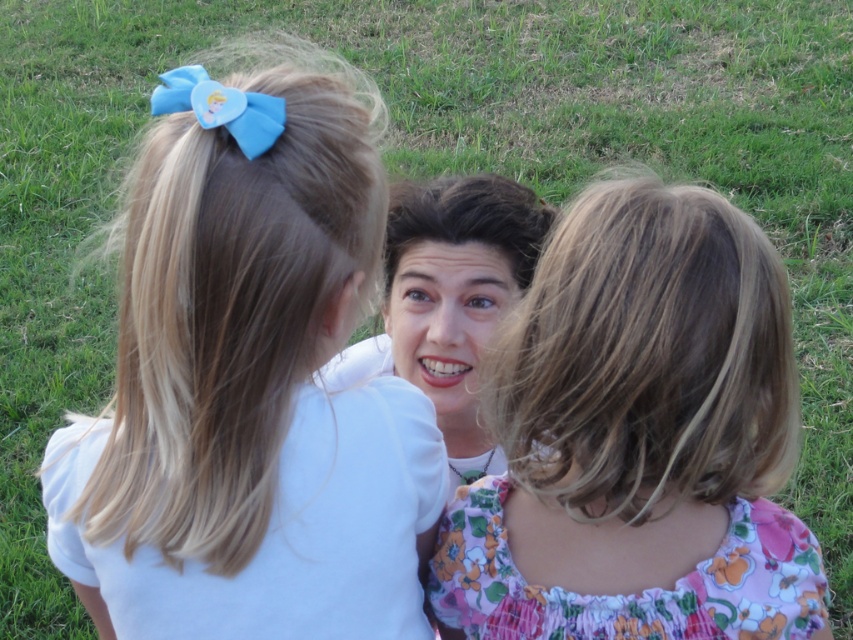
You are a photographer trying to capture a group photo of the two children and the adult. You want to ensure that the floral fabric dress at center and the dark brown silky hair at center are both visible in the frame. Considering their heights, which object should you focus on to ensure both are visible?

The floral fabric dress at center is much taller than the dark brown silky hair at center, so focusing on the floral fabric dress at center would ensure the dark brown silky hair at center is also visible in the frame.

You are standing at the origin of the coordinate system in the image. You see a blue fabric bow at upper left located at point (248, 380). If you move 0.1 units to the right, will you be closer to or farther from the blue fabric bow at upper left?

Moving 0.1 units to the right from the origin would take you to the point 0.694, 0.293. The blue fabric bow at upper left is at (248, 380). Since the x coordinate increased, you are moving away from the blue fabric bow at upper left along the horizontal axis, so you would be farther from it.